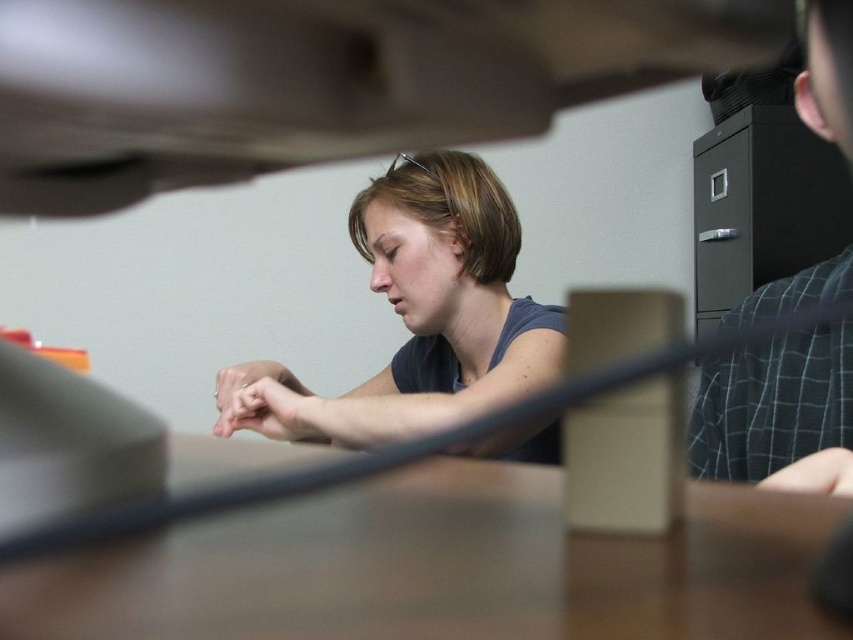
Is plaid shirt at right above matte black hand at center?

Yes.

Between plaid shirt at right and matte black hand at center, which one appears on the left side from the viewer's perspective?

matte black hand at center is more to the left.

Between point (811, 376) and point (230, 403), which one is positioned in front?

Positioned in front is point (811, 376).

Where is `plaid shirt at right`? plaid shirt at right is located at coordinates (778, 413).

Which is more to the left, brown matte table at center or smooth skin hand at lower right?

brown matte table at center

Is brown matte table at center below smooth skin hand at lower right?

No, brown matte table at center is not below smooth skin hand at lower right.

Locate an element on the screen. Image resolution: width=853 pixels, height=640 pixels. brown matte table at center is located at coordinates [444, 568].

You are a GUI agent. You are given a task and a screenshot of the screen. Output one action in this format:
    pyautogui.click(x=<x>, y=<y>)
    Task: Click on the brown matte table at center
    This screenshot has height=640, width=853.
    Given the screenshot: What is the action you would take?
    pyautogui.click(x=444, y=568)

Is the position of brown matte table at center more distant than that of matte black hand at center?

No, it is in front of matte black hand at center.

This screenshot has width=853, height=640. Identify the location of brown matte table at center. (444, 568).

Locate an element on the screen. The image size is (853, 640). brown matte table at center is located at coordinates click(x=444, y=568).